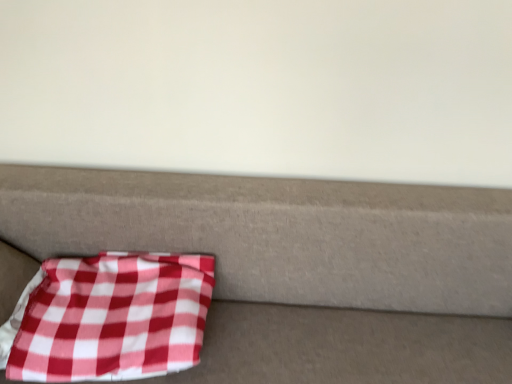
Question: Is red checkered fabric at lower left wider or thinner than red checkered fabric at lower left?

Choices:
 (A) wide
 (B) thin

Answer: (B)

Question: Is red checkered fabric at lower left inside or outside of red checkered fabric at lower left?

Choices:
 (A) inside
 (B) outside

Answer: (A)

Question: From the image's perspective, relative to red checkered fabric at lower left, is red checkered fabric at lower left above or below?

Choices:
 (A) below
 (B) above

Answer: (B)

Question: Relative to red checkered fabric at lower left, is red checkered fabric at lower left in front or behind?

Choices:
 (A) behind
 (B) front

Answer: (B)

Question: Considering the positions of red checkered fabric at lower left and red checkered fabric at lower left in the image, is red checkered fabric at lower left bigger or smaller than red checkered fabric at lower left?

Choices:
 (A) small
 (B) big

Answer: (B)

Question: From a real-world perspective, relative to red checkered fabric at lower left, is red checkered fabric at lower left vertically above or below?

Choices:
 (A) above
 (B) below

Answer: (B)

Question: From their relative heights in the image, would you say red checkered fabric at lower left is taller or shorter than red checkered fabric at lower left?

Choices:
 (A) tall
 (B) short

Answer: (A)